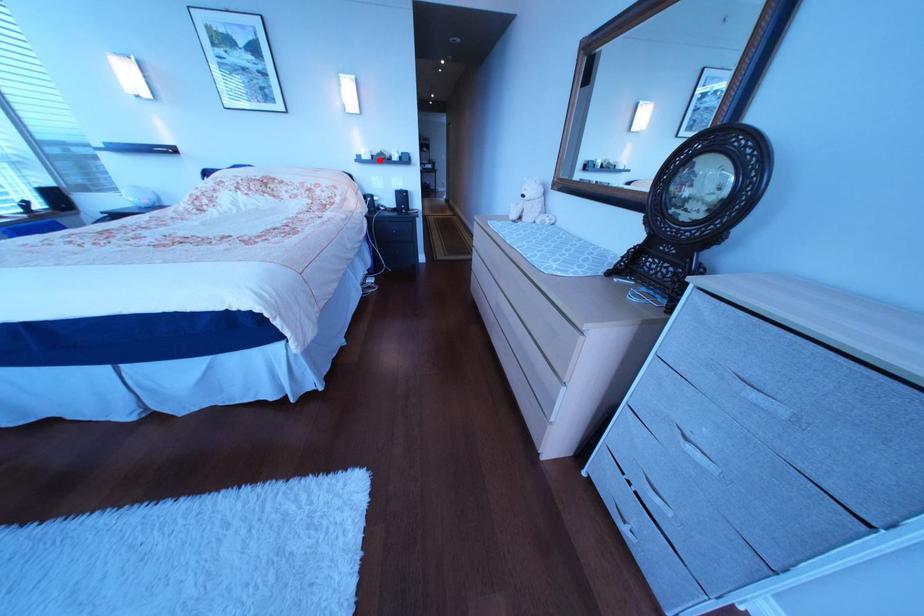
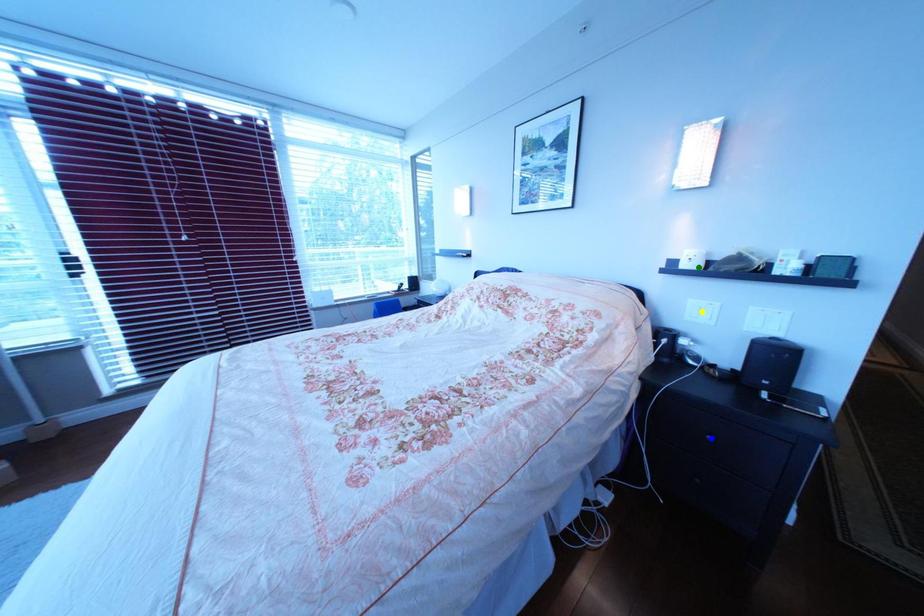
Question: I am providing you with two images of the same scene from different viewpoints. A red point is marked on the first image. You are given multiple points on the second image. Can you choose the point in image 2 that corresponds to the point in image 1?

Choices:
 (A) green point
 (B) blue point
 (C) yellow point

Answer: (A)